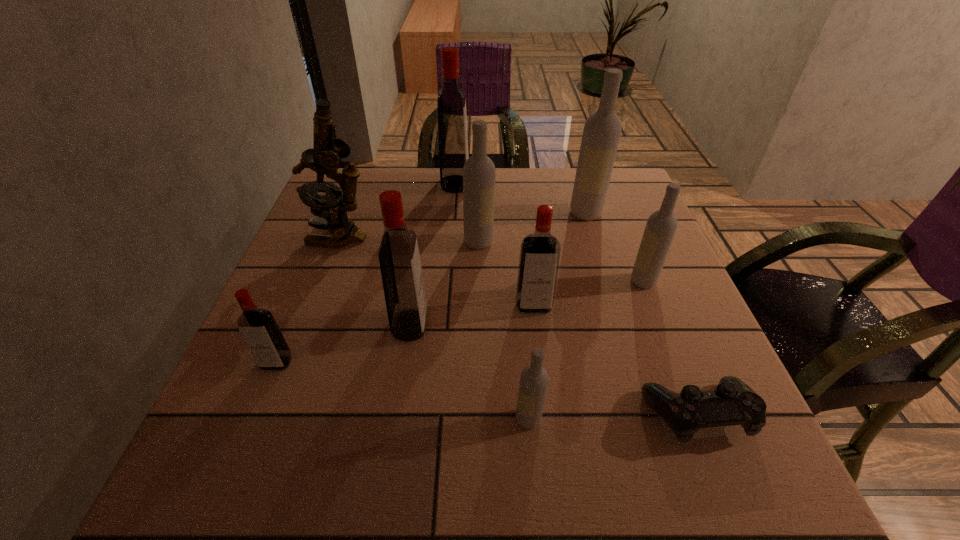
At what (x,y) coordinates should I click in order to perform the action: click on object that is at the far right corner. Please return your answer as a coordinate pair (x, y). The image size is (960, 540). Looking at the image, I should click on (x=602, y=130).

Locate an element on the screen. The image size is (960, 540). object that is at the near right corner is located at coordinates (732, 402).

Identify the location of free spot at the far edge of the desktop. (499, 195).

This screenshot has height=540, width=960. In the image, there is a desktop. In order to click on free space at the near edge in this screenshot , I will do `click(348, 485)`.

At what (x,y) coordinates should I click in order to perform the action: click on free space at the left edge of the desktop. Please return your answer as a coordinate pair (x, y). Looking at the image, I should click on (353, 265).

Locate an element on the screen. blank area at the right edge is located at coordinates (658, 314).

Where is `vacant space at the far left corner of the desktop`? The width and height of the screenshot is (960, 540). vacant space at the far left corner of the desktop is located at coordinates (373, 205).

Find the location of a particular element. The height and width of the screenshot is (540, 960). blank space at the near right corner of the desktop is located at coordinates (669, 443).

I want to click on vacant area between the third smallest red vodka and the leftmost white vodka, so click(x=444, y=284).

Locate an element on the screen. vacant area that lies between the smallest red vodka and the third farthest white vodka is located at coordinates (460, 322).